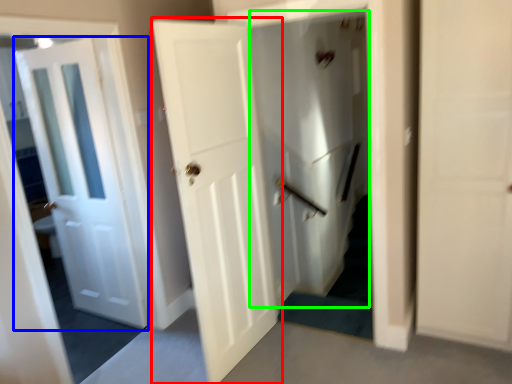
Question: Based on their relative distances, which object is nearer to door (highlighted by a red box)? Choose from door (highlighted by a blue box) and elevator (highlighted by a green box).

Choices:
 (A) door
 (B) elevator

Answer: (A)